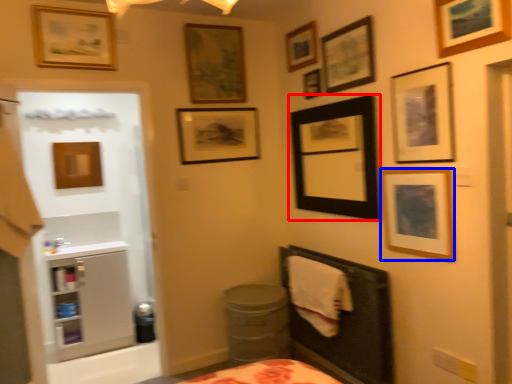
Question: Which of the following is the farthest to the observer, picture frame (highlighted by a red box) or picture frame (highlighted by a blue box)?

Choices:
 (A) picture frame
 (B) picture frame

Answer: (A)